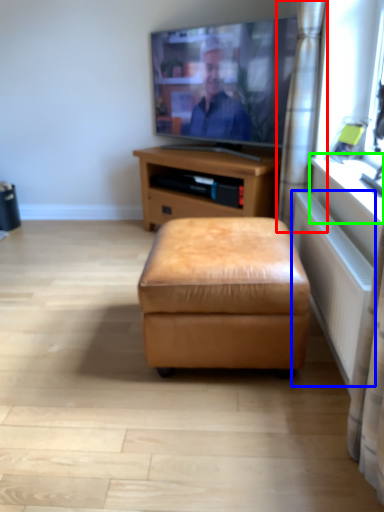
Question: Which object is the farthest from curtain (highlighted by a red box)? Choose among these: radiator (highlighted by a blue box) or window sill (highlighted by a green box).

Choices:
 (A) radiator
 (B) window sill

Answer: (A)